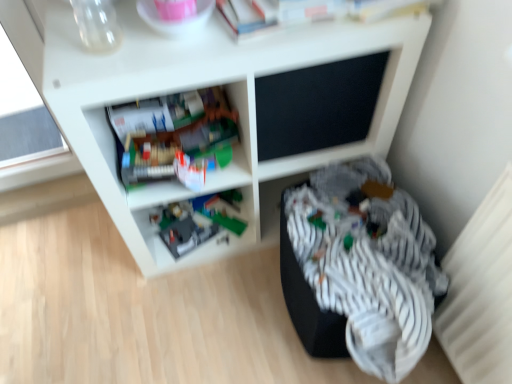
Question: In the image, is striped fabric at lower right on the left side or the right side of plastic gray toy at lower center, the 2th shelf from the front?

Choices:
 (A) left
 (B) right

Answer: (B)

Question: From their relative heights in the image, would you say striped fabric at lower right is taller or shorter than plastic gray toy at lower center, the 2th shelf from the front?

Choices:
 (A) short
 (B) tall

Answer: (B)

Question: Which object is positioned closest to the white matte shelf at center, which appears as the second shelf when viewed from the back?

Choices:
 (A) plastic gray toy at lower center, positioned as the first shelf in back-to-front order
 (B) striped fabric at lower right

Answer: (A)

Question: Considering the real-world distances, which object is farthest from the white matte shelf at center, which appears as the second shelf when viewed from the back?

Choices:
 (A) striped fabric at lower right
 (B) plastic gray toy at lower center, positioned as the first shelf in back-to-front order

Answer: (A)